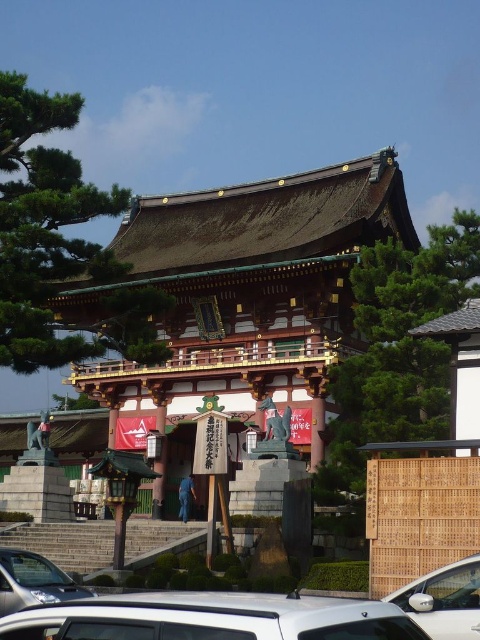
Does white glossy car at lower right appear on the left side of silver metallic car at lower left?

No, white glossy car at lower right is not to the left of silver metallic car at lower left.

Which of these two, white glossy car at lower right or silver metallic car at lower left, stands shorter?

white glossy car at lower right

Who is more distant from viewer, (474, 572) or (7, 595)?

Positioned behind is point (7, 595).

Find the location of a particular element. white glossy car at lower right is located at coordinates (444, 600).

Measure the distance between shiny gold/wooden temple at center and white glossy car at lower right.

shiny gold/wooden temple at center and white glossy car at lower right are 143.37 feet apart from each other.

Identify the location of shiny gold/wooden temple at center. (244, 294).

Between shiny gold/wooden temple at center and white matte car at lower center, which one appears on the left side from the viewer's perspective?

shiny gold/wooden temple at center

Is shiny gold/wooden temple at center further to the viewer compared to white matte car at lower center?

Yes.

Who is more distant from viewer, (x=269, y=196) or (x=217, y=596)?

Point (x=269, y=196)

Image resolution: width=480 pixels, height=640 pixels. I want to click on shiny gold/wooden temple at center, so click(x=244, y=294).